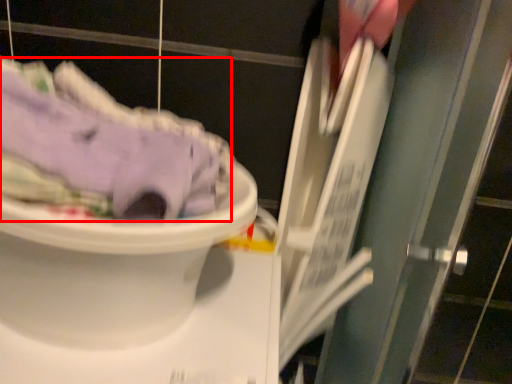
Question: Considering the relative positions of clothing (annotated by the red box) and toilet in the image provided, where is clothing (annotated by the red box) located with respect to the staircase?

Choices:
 (A) left
 (B) right

Answer: (B)